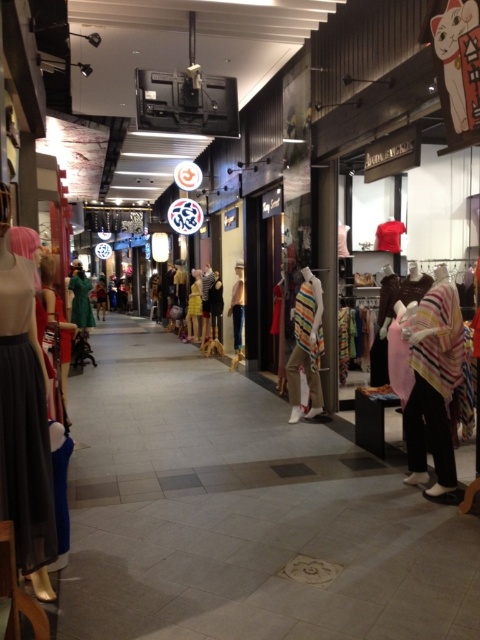
Question: Which of the following is the farthest from the observer?

Choices:
 (A) tap(239, 348)
 (B) tap(201, 308)
 (C) tap(177, 285)
 (D) tap(10, 433)

Answer: (C)

Question: Among these points, which one is farthest from the camera?

Choices:
 (A) (237, 262)
 (B) (205, 310)

Answer: (B)

Question: Based on their relative distances, which object is nearer to the white cotton shirt at center?

Choices:
 (A) striped fabric vest at center
 (B) green matte coat at center
 (C) matte pink skirt at left
 (D) yellow fabric dress at center

Answer: (D)

Question: Does striped fabric vest at center appear under yellow fabric dress at center?

Choices:
 (A) no
 (B) yes

Answer: (B)

Question: Is matte pink skirt at left positioned in front of striped fabric scarf at center?

Choices:
 (A) no
 (B) yes

Answer: (B)

Question: Is white cotton shirt at center smaller than yellow fabric dress at center?

Choices:
 (A) no
 (B) yes

Answer: (A)